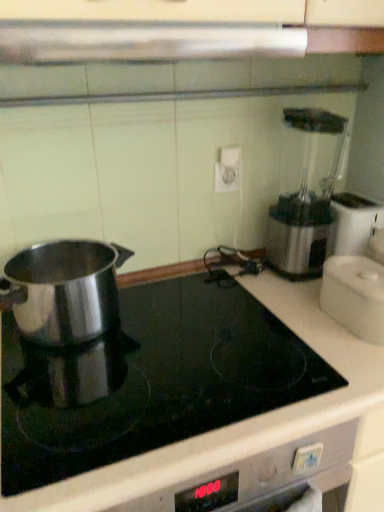
Where is `free space in front of white plastic container at right, which is counted as the first kitchen appliance, starting from the right`? free space in front of white plastic container at right, which is counted as the first kitchen appliance, starting from the right is located at coordinates (355, 367).